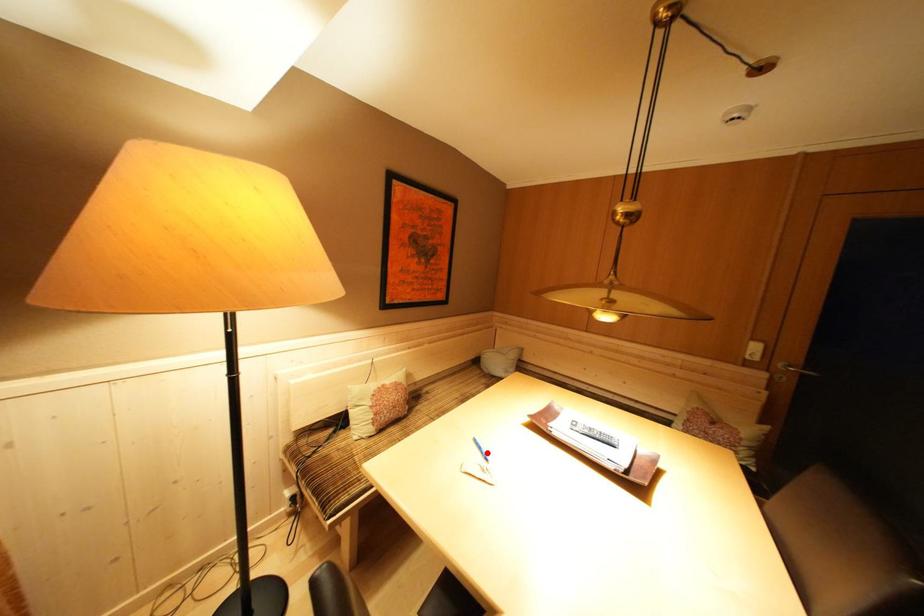
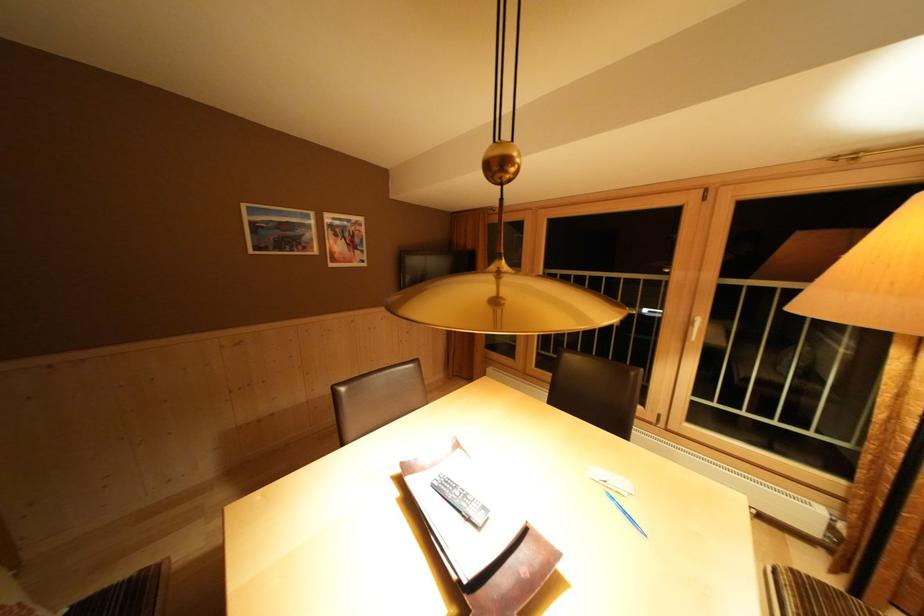
The point at the highlighted location is marked in the first image. Where is the corresponding point in the second image?

(633, 517)